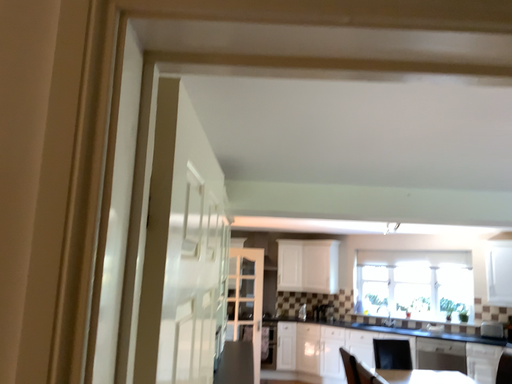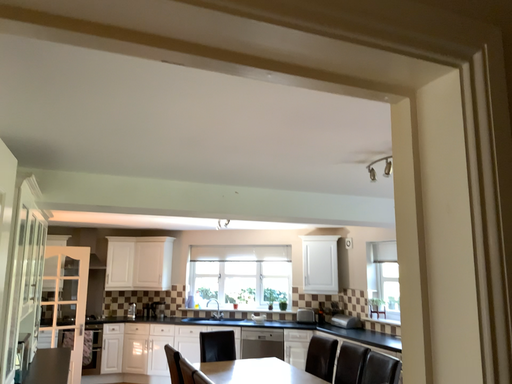
Question: How did the camera likely rotate when shooting the video?

Choices:
 (A) rotated right
 (B) rotated left

Answer: (A)